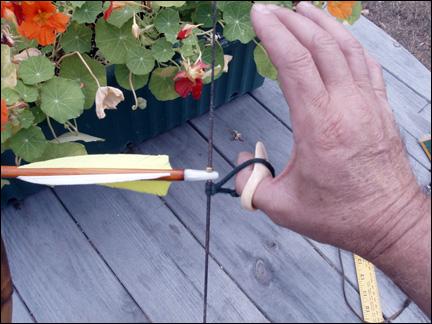
Locate an element on the screen. orange flowers is located at coordinates (37, 31), (2, 115), (6, 7).